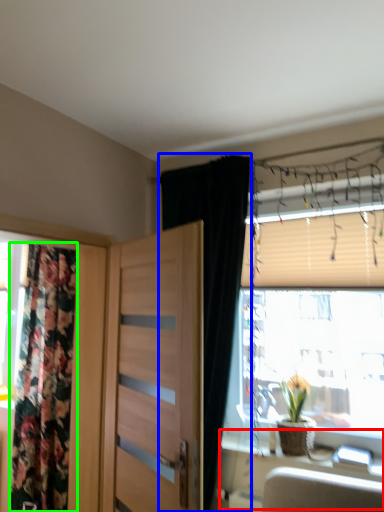
Question: Based on their relative distances, which object is nearer to table (highlighted by a red box)? Choose from curtain (highlighted by a blue box) and curtain (highlighted by a green box).

Choices:
 (A) curtain
 (B) curtain

Answer: (A)